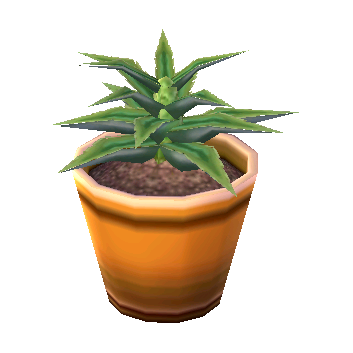
Where is `flower pot`? This screenshot has width=353, height=353. flower pot is located at coordinates (171, 241).